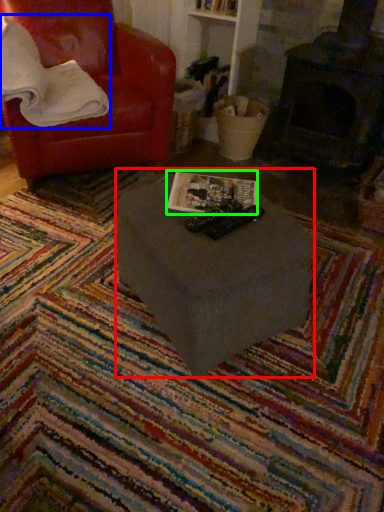
Question: Estimate the real-world distances between objects in this image. Which object is closer to table (highlighted by a red box), pillow (highlighted by a blue box) or magazine (highlighted by a green box)?

Choices:
 (A) pillow
 (B) magazine

Answer: (B)